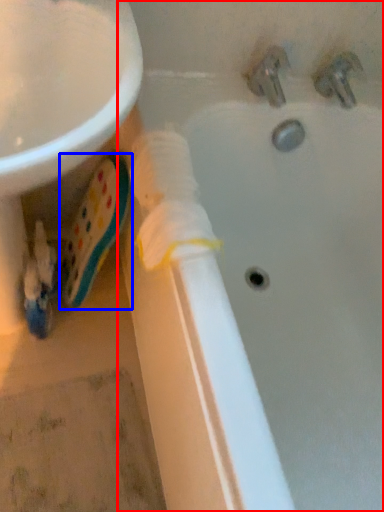
Question: Which point is further to the camera, bathtub (highlighted by a red box) or toothpaste (highlighted by a blue box)?

Choices:
 (A) bathtub
 (B) toothpaste

Answer: (B)